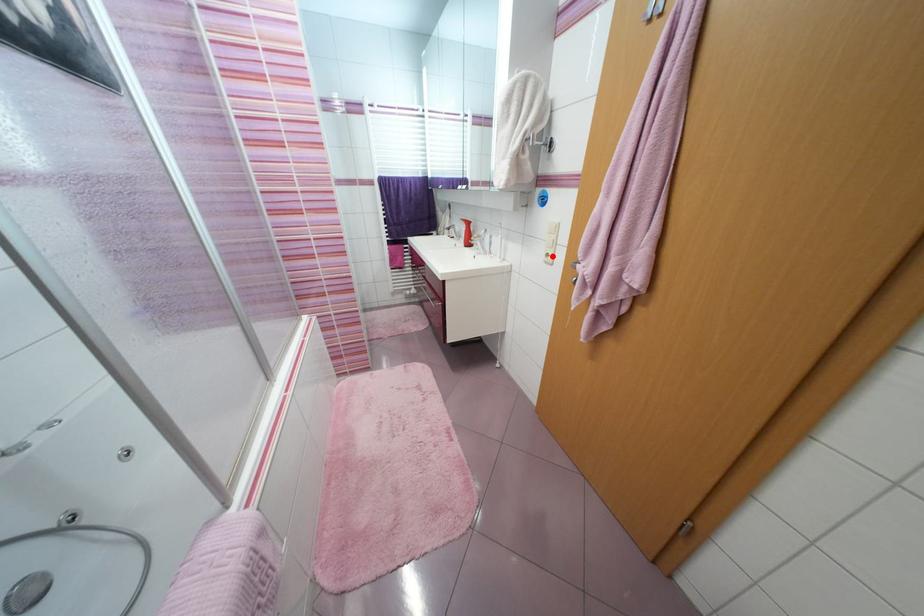
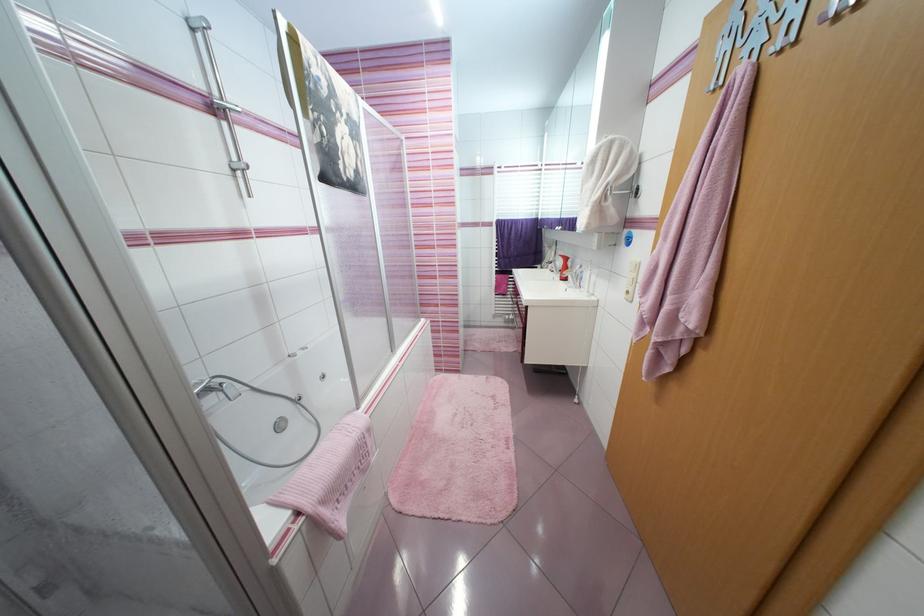
Question: I am providing you with two images of the same scene from different viewpoints. A red point is marked on the first image. Can you still see the location of the red point in image 2?

Choices:
 (A) Yes
 (B) No

Answer: (A)